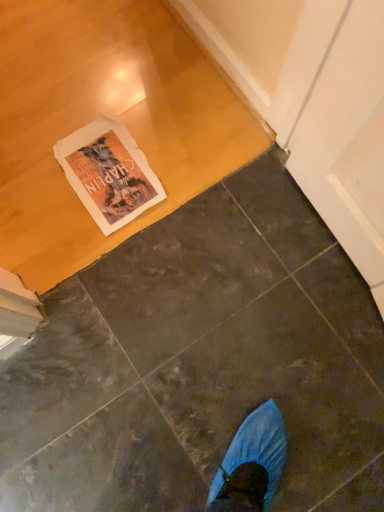
The image size is (384, 512). I want to click on vacant area that lies to the right of white paper magazine at upper left, so click(205, 168).